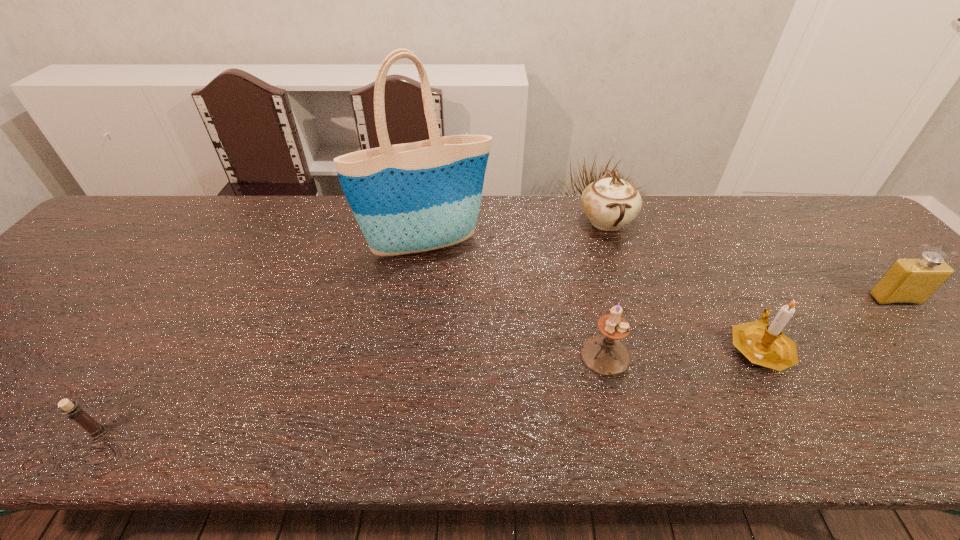
In the image, there is a desktop. Identify the location of free space at the near edge. (119, 414).

In the image, there is a desktop. At what (x,y) coordinates should I click in order to perform the action: click on blank space at the left edge. Please return your answer as a coordinate pair (x, y). The width and height of the screenshot is (960, 540). Looking at the image, I should click on (45, 320).

The height and width of the screenshot is (540, 960). Find the location of `vacant space at the far left corner of the desktop`. vacant space at the far left corner of the desktop is located at coordinates (122, 215).

In the image, there is a desktop. Identify the location of free region at the far right corner. (821, 241).

Identify the location of unoccupied area between the shortest candle holder and the rightmost candle holder. (429, 389).

Identify the location of empty space that is in between the leftmost object and the second candle holder from right to left. (351, 394).

This screenshot has width=960, height=540. I want to click on vacant area that lies between the second object from right to left and the second candle holder from left to right, so click(683, 351).

Where is `vacant point located between the shortest candle holder and the fifth object from left to right`? This screenshot has width=960, height=540. vacant point located between the shortest candle holder and the fifth object from left to right is located at coordinates (429, 389).

The height and width of the screenshot is (540, 960). Find the location of `vacant point located between the shortest object and the second candle holder from left to right`. vacant point located between the shortest object and the second candle holder from left to right is located at coordinates (351, 394).

At what (x,y) coordinates should I click in order to perform the action: click on vacant area that lies between the rightmost candle holder and the nearest object. Please return your answer as a coordinate pair (x, y). Looking at the image, I should click on (429, 389).